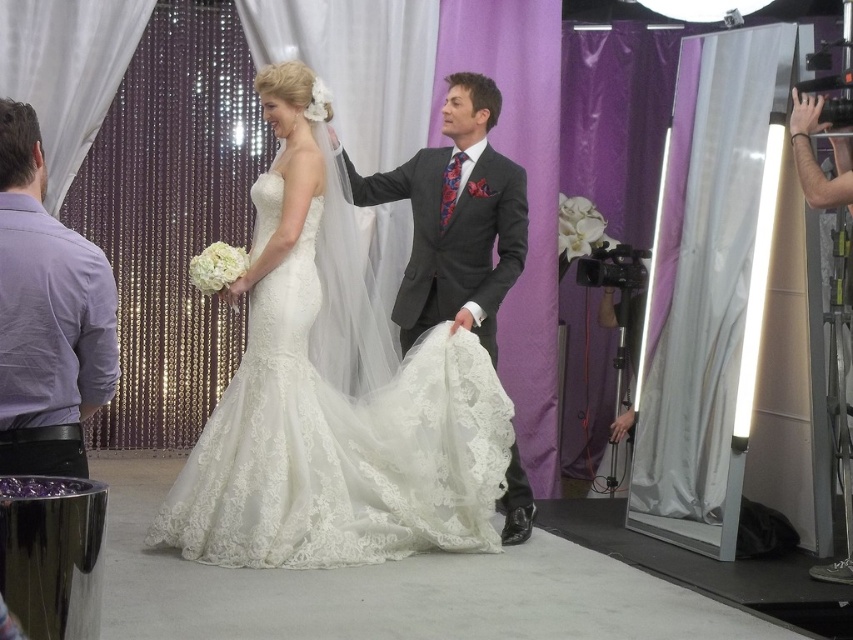
Can you confirm if purple cotton shirt at left is positioned below matte gray suit at center?

Indeed, purple cotton shirt at left is positioned under matte gray suit at center.

Can you confirm if purple cotton shirt at left is smaller than matte gray suit at center?

Yes, purple cotton shirt at left is smaller than matte gray suit at center.

Who is more distant from viewer, (36, 300) or (503, 536)?

Positioned behind is point (503, 536).

You are a GUI agent. You are given a task and a screenshot of the screen. Output one action in this format:
    pyautogui.click(x=<x>, y=<y>)
    Task: Click on the purple cotton shirt at left
    
    Given the screenshot: What is the action you would take?
    pyautogui.click(x=47, y=316)

Based on the photo, does lace fabric dress at center have a lesser width compared to purple cotton shirt at left?

No, lace fabric dress at center is not thinner than purple cotton shirt at left.

Is the position of lace fabric dress at center less distant than that of purple cotton shirt at left?

No, it is not.

Between point (477, 344) and point (19, 134), which one is positioned in front?

Positioned in front is point (19, 134).

Find the location of `lace fabric dress at center`. lace fabric dress at center is located at coordinates (339, 433).

Does lace fabric dress at center have a larger size compared to matte gray suit at center?

Correct, lace fabric dress at center is larger in size than matte gray suit at center.

Who is shorter, lace fabric dress at center or matte gray suit at center?

Standing shorter between the two is matte gray suit at center.

Does point (276, 522) come in front of point (480, 333)?

Yes.

Locate an element on the screen. The image size is (853, 640). lace fabric dress at center is located at coordinates (339, 433).